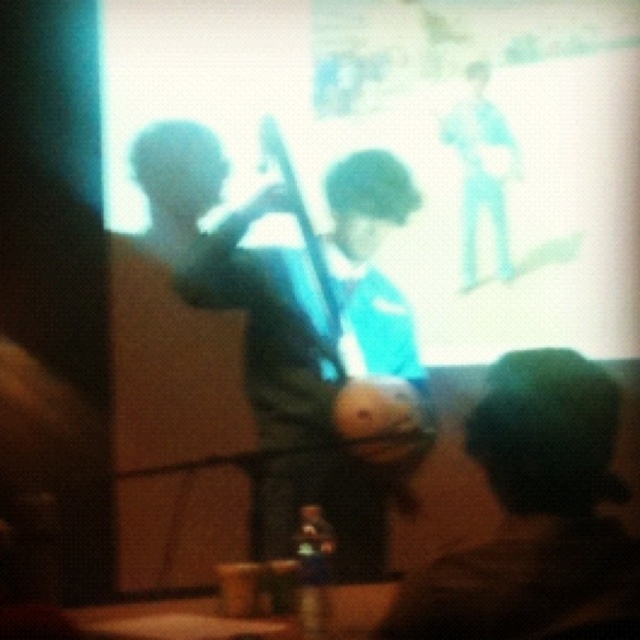
Question: Is blue fabric shirt at center closer to camera compared to green fuzzy hat at lower right?

Choices:
 (A) yes
 (B) no

Answer: (B)

Question: Is white glossy projection screen at upper center bigger than green fuzzy hat at lower right?

Choices:
 (A) yes
 (B) no

Answer: (A)

Question: Which point is closer to the camera?

Choices:
 (A) blue fabric shirt at center
 (B) white glossy projection screen at upper center
 (C) green fuzzy hat at lower right

Answer: (C)

Question: Which point is closer to the camera?

Choices:
 (A) blue fabric shirt at center
 (B) white glossy projection screen at upper center
 (C) green fuzzy hat at lower right

Answer: (C)

Question: Is blue fabric shirt at center below green fuzzy hat at lower right?

Choices:
 (A) yes
 (B) no

Answer: (B)

Question: Which point is farther from the camera taking this photo?

Choices:
 (A) pyautogui.click(x=524, y=449)
 (B) pyautogui.click(x=314, y=429)

Answer: (B)